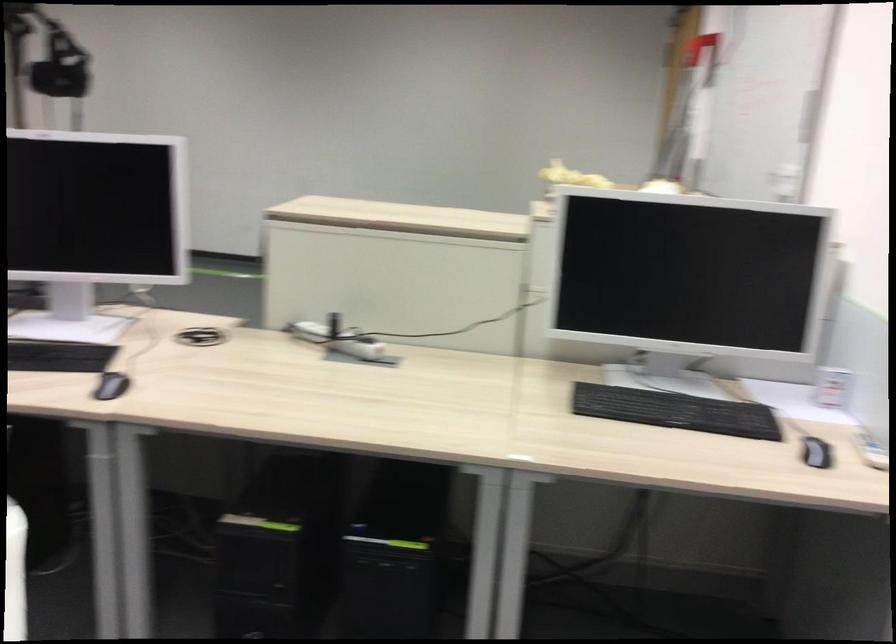
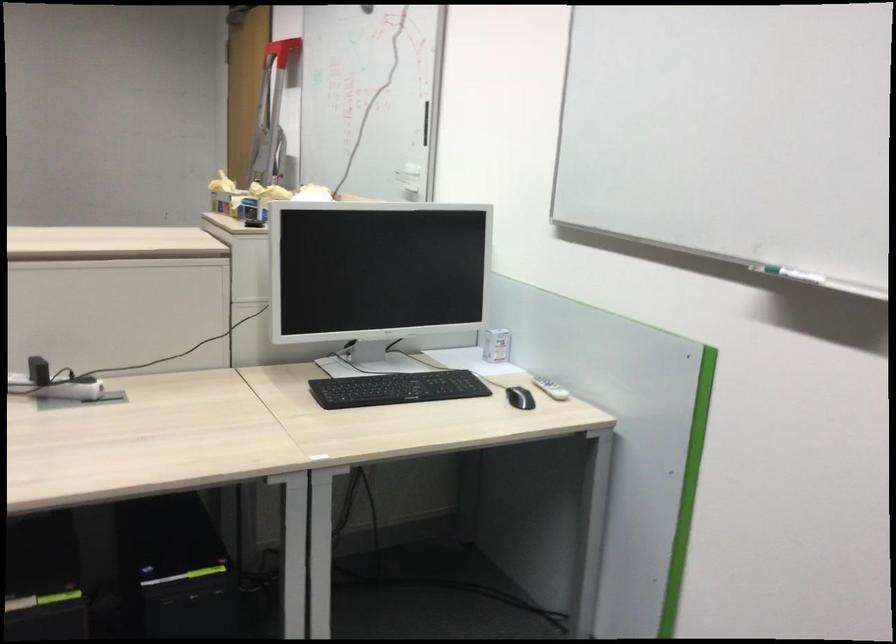
Find the pixel in the second image that matches the point at 346,335 in the first image.

(53, 383)